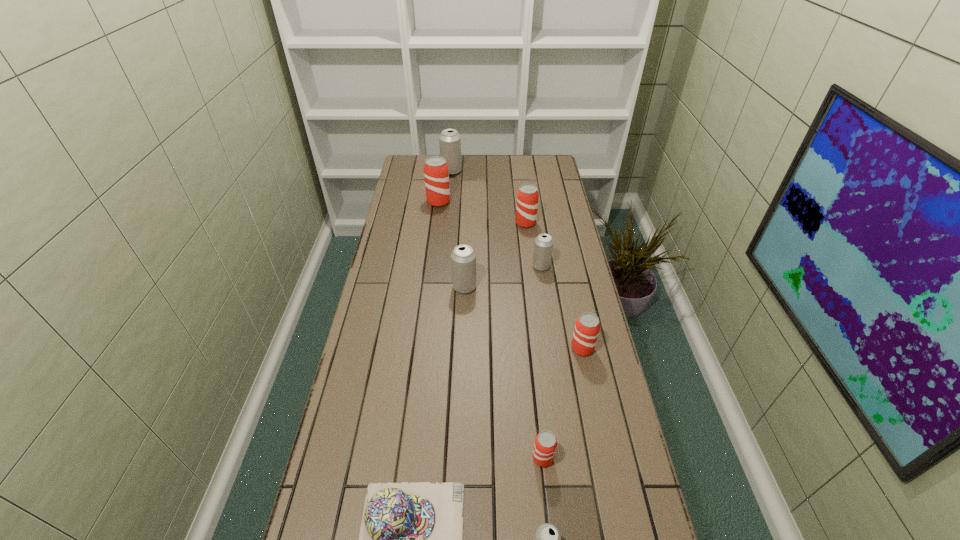
At what (x,y) coordinates should I click in order to perform the action: click on vacant space situated 0.180m on the back of the nearest orange beer can. Please return your answer as a coordinate pair (x, y). This screenshot has width=960, height=540. Looking at the image, I should click on (536, 387).

Find the location of a particular element. The width and height of the screenshot is (960, 540). object at the far edge is located at coordinates (449, 140).

What are the coordinates of `object at the left edge` in the screenshot? It's located at (436, 173).

The height and width of the screenshot is (540, 960). Find the location of `vacant space at the far edge`. vacant space at the far edge is located at coordinates (x=503, y=178).

The width and height of the screenshot is (960, 540). Identify the location of free spot at the left edge of the desktop. (422, 240).

In the image, there is a desktop. At what (x,y) coordinates should I click in order to perform the action: click on vacant space at the right edge. Please return your answer as a coordinate pair (x, y). The height and width of the screenshot is (540, 960). Looking at the image, I should click on point(610,435).

This screenshot has height=540, width=960. Find the location of `free area in between the third biggest white beer can and the farthest beer can`. free area in between the third biggest white beer can and the farthest beer can is located at coordinates [496, 219].

The image size is (960, 540). What are the coordinates of `vacant space in between the biggest white beer can and the third farthest beer can` in the screenshot? It's located at (489, 197).

Identify the location of vacant area that lies between the third biggest orange beer can and the rightmost white beer can. (562, 307).

Locate an element on the screen. The height and width of the screenshot is (540, 960). vacant region between the nearest orange beer can and the third farthest white beer can is located at coordinates (504, 373).